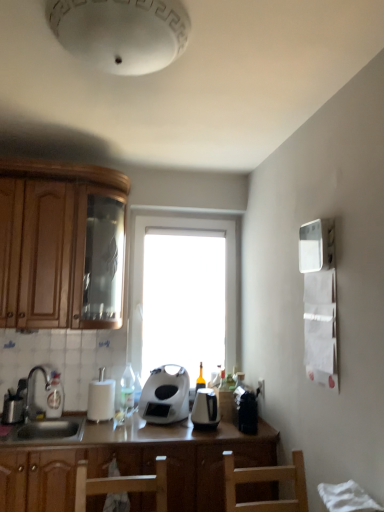
You are a GUI agent. You are given a task and a screenshot of the screen. Output one action in this format:
    pyautogui.click(x=<x>, y=<y>)
    Task: Click on the free spot to the left of white matte paper towel holder at center
    The image size is (384, 512).
    Given the screenshot: What is the action you would take?
    pyautogui.click(x=72, y=417)